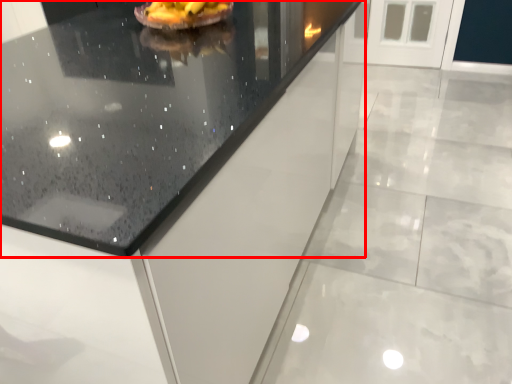
Question: In this image, where is countertop (annotated by the red box) located relative to food?

Choices:
 (A) right
 (B) left

Answer: (A)